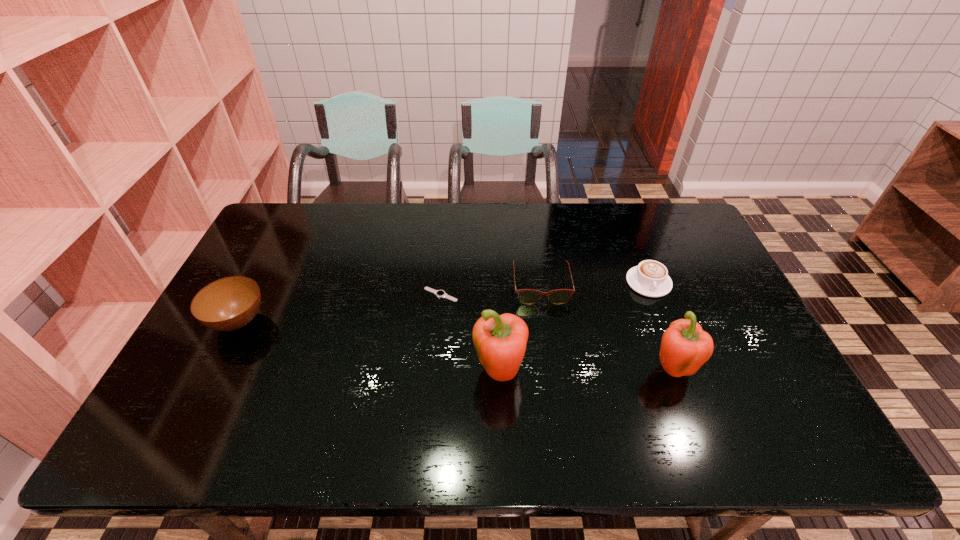
What are the coordinates of `vacant area located on the left of the tallest object` in the screenshot? It's located at (414, 374).

I want to click on blank space located on the back of the shorter pepper, so click(x=653, y=316).

This screenshot has height=540, width=960. In order to click on free space located on the right of the fifth object from right to left in this screenshot , I will do coord(525,295).

At what (x,y) coordinates should I click in order to perform the action: click on vacant space located 0.280m with the handle on the right side of the cappuccino. Please return your answer as a coordinate pair (x, y). The width and height of the screenshot is (960, 540). Looking at the image, I should click on (686, 380).

This screenshot has height=540, width=960. What are the coordinates of `vacant position located 0.220m at the front view of the spectacles` in the screenshot? It's located at (552, 368).

Find the location of a particular element. free region located 0.090m on the front of the bowl is located at coordinates (211, 374).

This screenshot has width=960, height=540. I want to click on object that is at the left edge, so click(x=227, y=304).

You are a GUI agent. You are given a task and a screenshot of the screen. Output one action in this format:
    pyautogui.click(x=<x>, y=<y>)
    Task: Click on the free space at the far edge of the desktop
    Image resolution: width=960 pixels, height=540 pixels.
    Given the screenshot: What is the action you would take?
    pyautogui.click(x=594, y=233)

Identify the location of vacant area at the near edge. Image resolution: width=960 pixels, height=540 pixels. (247, 403).

Find the location of `free space at the left edge`. free space at the left edge is located at coordinates (262, 260).